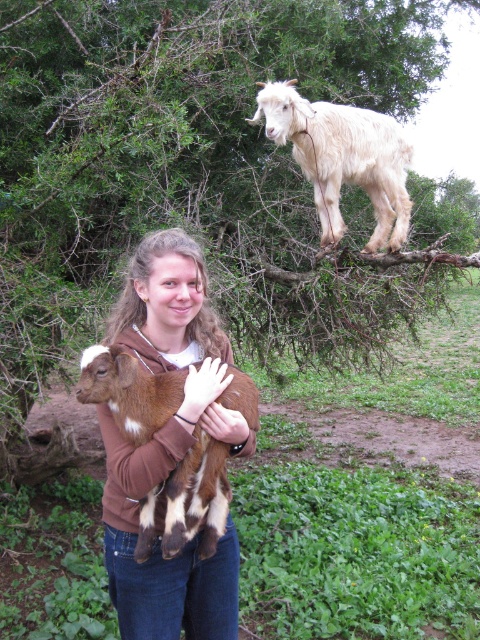
I want to click on white woolen goat at upper center, so click(342, 157).

Between white woolen goat at upper center and white matte glove at center, which one has more height?

Standing taller between the two is white woolen goat at upper center.

Locate an element on the screen. white woolen goat at upper center is located at coordinates (342, 157).

At what (x,y) coordinates should I click in order to perform the action: click on white woolen goat at upper center. Please return your answer as a coordinate pair (x, y). This screenshot has width=480, height=640. Looking at the image, I should click on (342, 157).

Does brown soft fur at center have a lesser width compared to white matte glove at center?

In fact, brown soft fur at center might be wider than white matte glove at center.

Can you confirm if brown soft fur at center is shorter than white matte glove at center?

No, brown soft fur at center is not shorter than white matte glove at center.

Is point (216, 552) closer to camera compared to point (208, 397)?

No, it is behind (208, 397).

Find the location of a particular element. brown soft fur at center is located at coordinates (157, 547).

Does brown soft fur at center appear on the left side of white woolen goat at upper center?

Correct, you'll find brown soft fur at center to the left of white woolen goat at upper center.

Can you confirm if brown soft fur at center is taller than white woolen goat at upper center?

Indeed, brown soft fur at center has a greater height compared to white woolen goat at upper center.

This screenshot has width=480, height=640. In order to click on brown soft fur at center in this screenshot , I will do `click(157, 547)`.